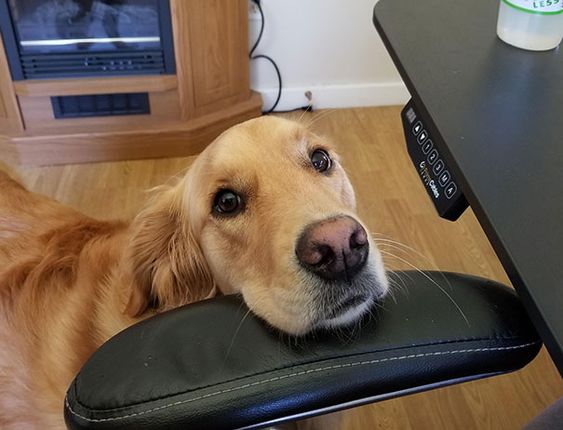
The image size is (563, 430). What are the coordinates of `black desk` in the screenshot? It's located at (510, 132).